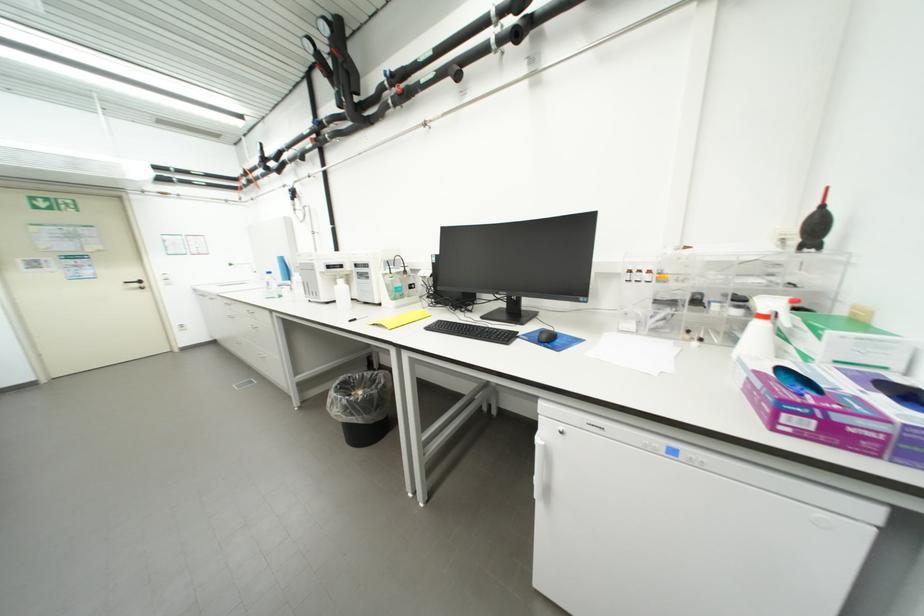
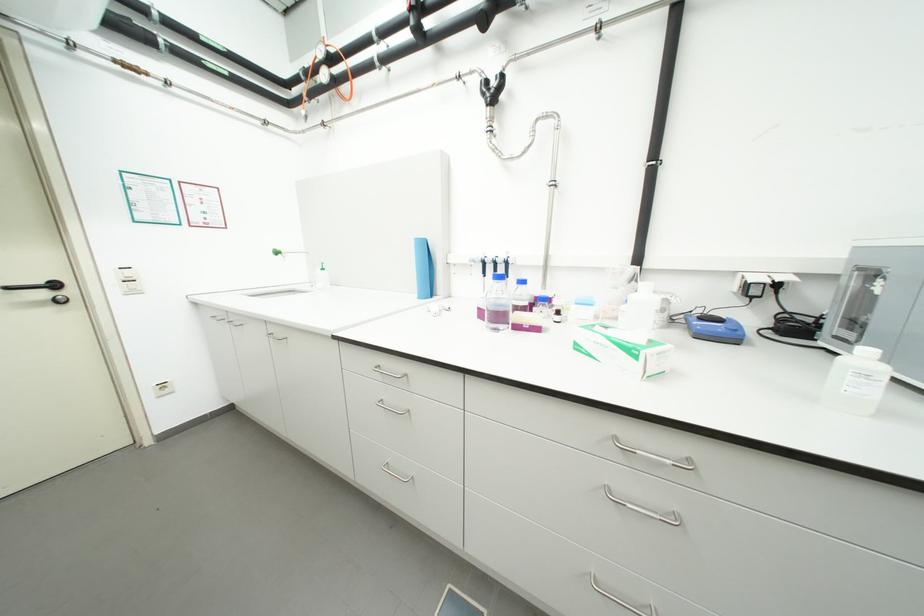
What movement of the cameraman would produce the second image?

The cameraman moved toward left, forward.